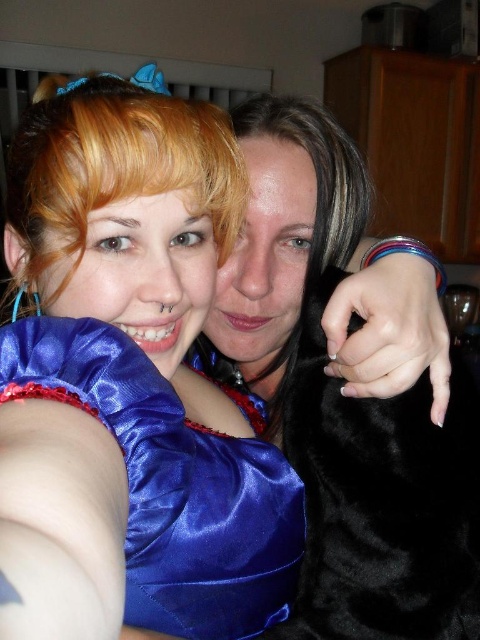
What are the coordinates of the satin blue dress at upper left?

The satin blue dress at upper left is located at point (130,381).

You are a photographer trying to capture a clear photo of the black fur coat at right. However, the satin blue dress at upper left is blocking your view. Can you move to the right side to get an unobstructed shot? Explain why or why not based on their positions.

The satin blue dress at upper left is to the left of the black fur coat at right. Moving to the right side would position you away from the dress, so yes, moving to the right should allow you to capture the black fur coat at right without obstruction from the dress.